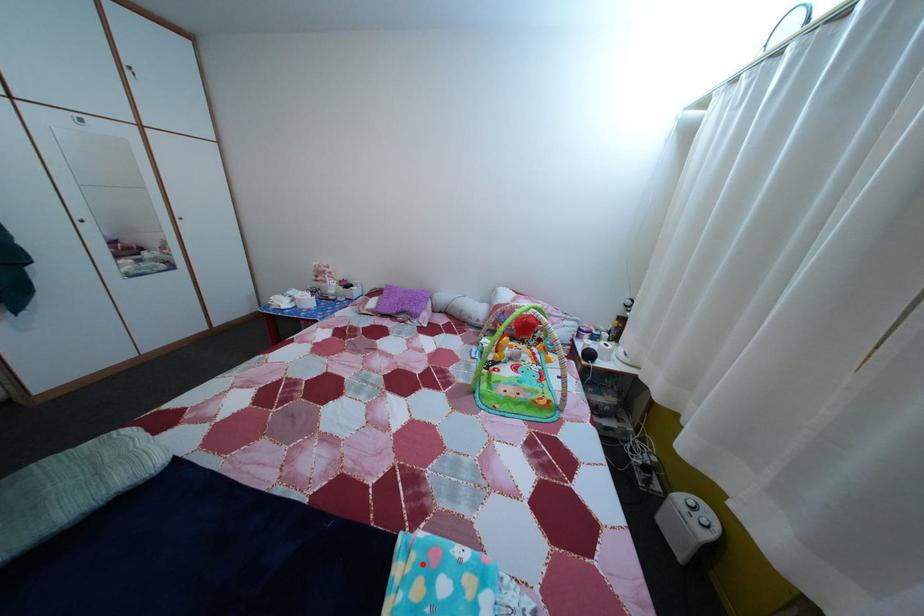
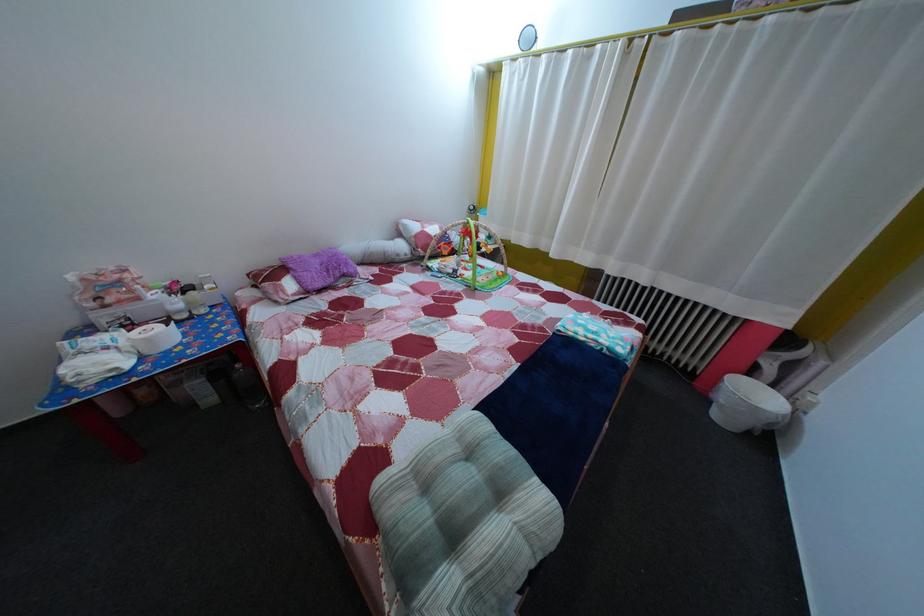
In the second image, find the point that corresponds to the highlighted location in the first image.

(578, 334)